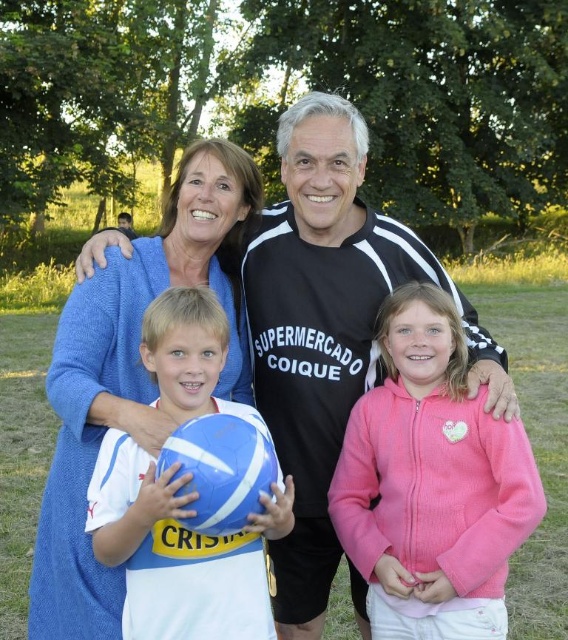
You are a photographer trying to capture a photo of the black jersey at center and the blue rubber beach ball at center. Based on their positions, which object should you focus on first if you want to capture both in one frame without moving the camera?

The blue rubber beach ball at center should be focused on first since the black jersey at center is to the right of it, ensuring both are within the frame when starting from the left.

You are standing in the park and want to take a photo of the blue wool sweater at upper left. Where should you position yourself to capture the sweater in the frame?

To capture the blue wool sweater at upper left in the frame, position yourself so that the sweater is centered at coordinates approximately 0.586 on the horizontal axis and 0.232 on the vertical axis.

You are a photographer setting up a tripod to take a group photo of the black jersey at center and the blue wool sweater at upper left. You want to ensure both are in focus. Which object should you place closer to the camera to achieve this?

To ensure both the black jersey at center and the blue wool sweater at upper left are in focus, you should place the blue wool sweater at upper left closer to the camera since it is narrower than the black jersey at center, allowing for better depth of field coverage.